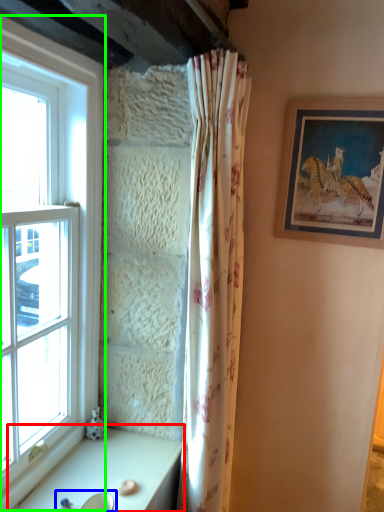
Question: Based on their relative distances, which object is farther from table (highlighted by a red box)? Choose from sink (highlighted by a blue box) and window (highlighted by a green box).

Choices:
 (A) sink
 (B) window

Answer: (B)